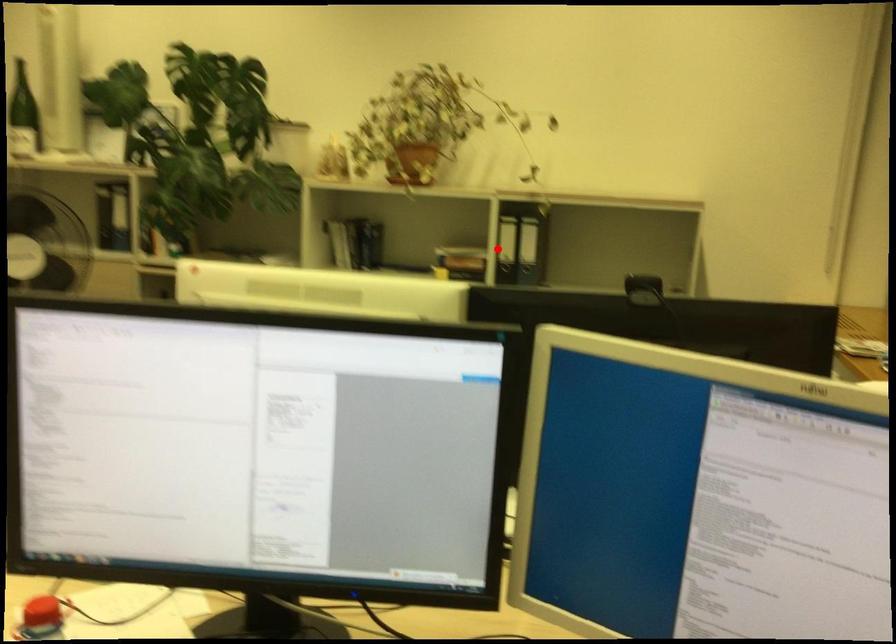
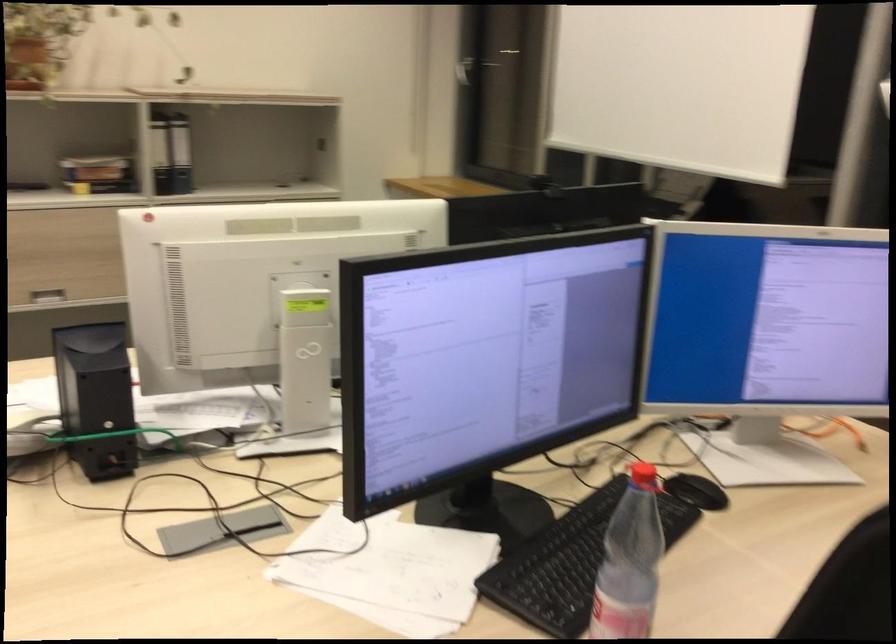
In the second image, find the point that corresponds to the highlighted location in the first image.

(160, 153)